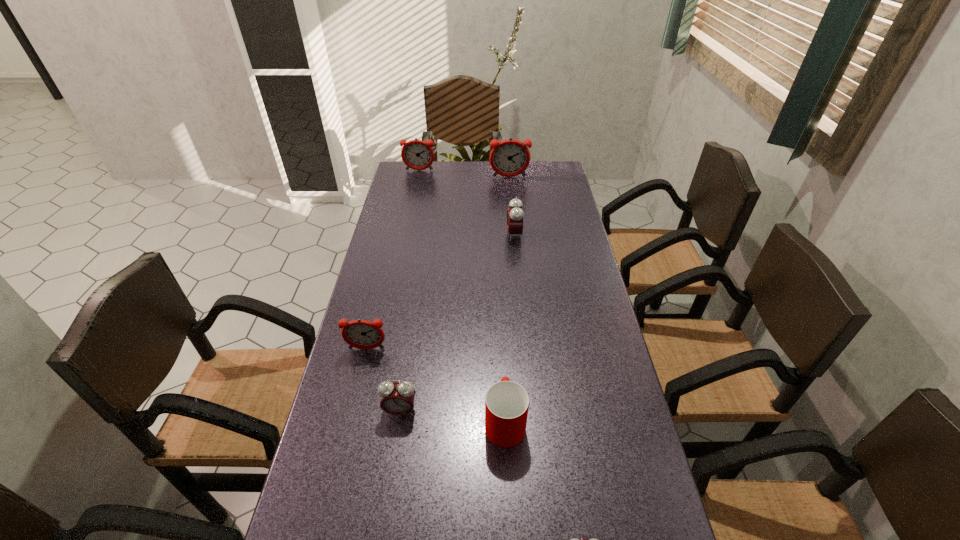
Where is `free space located 0.100m on the front-facing side of the fourth farthest object`? free space located 0.100m on the front-facing side of the fourth farthest object is located at coordinates (358, 384).

This screenshot has width=960, height=540. Identify the location of object located at the right edge. (508, 158).

The image size is (960, 540). Identify the location of object positioned at the far left corner. (418, 155).

The height and width of the screenshot is (540, 960). Identify the location of object that is at the far right corner. (508, 158).

You are a GUI agent. You are given a task and a screenshot of the screen. Output one action in this format:
    pyautogui.click(x=<x>, y=<y>)
    Task: Click on the blank space at the far edge of the desktop
    
    Given the screenshot: What is the action you would take?
    pyautogui.click(x=460, y=161)

The height and width of the screenshot is (540, 960). Find the location of `vacant region at the left edge of the desktop`. vacant region at the left edge of the desktop is located at coordinates (342, 469).

In the image, there is a desktop. At what (x,y) coordinates should I click in order to perform the action: click on vacant region at the right edge. Please return your answer as a coordinate pair (x, y). Looking at the image, I should click on (541, 201).

This screenshot has height=540, width=960. Find the location of `vacant point located between the second nearest alarm clock and the red cup`. vacant point located between the second nearest alarm clock and the red cup is located at coordinates (452, 416).

Identify the location of blank region between the second biggest reddish-pink alarm clock and the tallest object. (465, 174).

Locate an element on the screen. This screenshot has height=540, width=960. vacant area that lies between the second nearest reddish-pink alarm clock and the fifth nearest object is located at coordinates (512, 206).